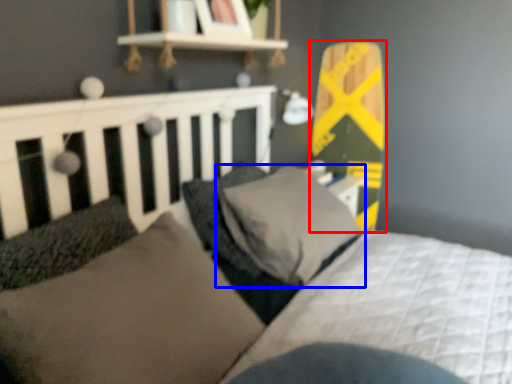
Question: Among these objects, which one is farthest to the camera, skateboard (highlighted by a red box) or pillow (highlighted by a blue box)?

Choices:
 (A) skateboard
 (B) pillow

Answer: (A)